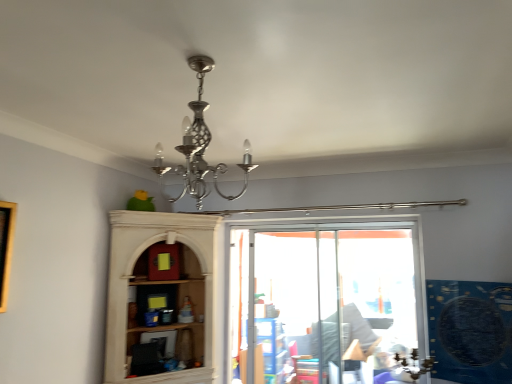
At what (x,y) coordinates should I click in order to perform the action: click on wooden picture frame at left. Please return your answer as a coordinate pair (x, y). The image size is (512, 384). Looking at the image, I should click on (6, 247).

Describe the element at coordinates (203, 145) in the screenshot. I see `polished silver chandelier at center` at that location.

I want to click on polished silver chandelier at center, so click(x=203, y=145).

This screenshot has width=512, height=384. What do you see at coordinates (273, 350) in the screenshot?
I see `blue plastic shelf at center` at bounding box center [273, 350].

Locate an element on the screen. The width and height of the screenshot is (512, 384). wooden picture frame at left is located at coordinates (6, 247).

In the image, is blue plastic shelf at center positioned in front of or behind wooden picture frame at left?

In the image, blue plastic shelf at center appears behind wooden picture frame at left.

From the picture: From a real-world perspective, is blue plastic shelf at center above or below wooden picture frame at left?

blue plastic shelf at center is situated lower than wooden picture frame at left in the real world.

Which of these two, blue plastic shelf at center or wooden picture frame at left, is bigger?

blue plastic shelf at center is bigger.

Is blue plastic shelf at center with wooden picture frame at left?

No, blue plastic shelf at center is not next to wooden picture frame at left.

Which object is wider, wooden picture frame at left or polished silver chandelier at center?

polished silver chandelier at center.

From the image's perspective, which object appears higher, wooden picture frame at left or polished silver chandelier at center?

polished silver chandelier at center is shown above in the image.

From the picture: Measure the distance between wooden picture frame at left and polished silver chandelier at center.

wooden picture frame at left is 3.69 feet from polished silver chandelier at center.

From the picture: Can you confirm if wooden picture frame at left is smaller than polished silver chandelier at center?

Yes, wooden picture frame at left is smaller than polished silver chandelier at center.

Which of these two, wooden picture frame at left or blue plastic shelf at center, is bigger?

Bigger between the two is blue plastic shelf at center.

Considering the relative positions of wooden picture frame at left and blue plastic shelf at center in the image provided, is wooden picture frame at left behind blue plastic shelf at center?

No, wooden picture frame at left is closer to the viewer.

Does wooden picture frame at left have a greater height compared to blue plastic shelf at center?

No, wooden picture frame at left is not taller than blue plastic shelf at center.

Is wooden picture frame at left next to blue plastic shelf at center?

They are not placed beside each other.

Can you confirm if polished silver chandelier at center is positioned to the right of wooden picture frame at left?

Yes, polished silver chandelier at center is to the right of wooden picture frame at left.

From a real-world perspective, is polished silver chandelier at center positioned under wooden picture frame at left based on gravity?

Actually, polished silver chandelier at center is physically above wooden picture frame at left in the real world.

Does polished silver chandelier at center have a greater height compared to wooden picture frame at left?

No.

Consider the image. From a real-world perspective, who is located higher, blue plastic shelf at center or polished silver chandelier at center?

In real-world perspective, polished silver chandelier at center is above.

Is blue plastic shelf at center in front of or behind polished silver chandelier at center in the image?

blue plastic shelf at center is behind polished silver chandelier at center.

Image resolution: width=512 pixels, height=384 pixels. Find the location of `lamp that appears on the left of blue plastic shelf at center`. lamp that appears on the left of blue plastic shelf at center is located at coordinates (203, 145).

Is point (180, 147) farther from viewer compared to point (261, 338)?

No.

Looking at their sizes, would you say polished silver chandelier at center is wider or thinner than blue plastic shelf at center?

polished silver chandelier at center is wider than blue plastic shelf at center.

Is polished silver chandelier at center not near blue plastic shelf at center?

Yes, polished silver chandelier at center is far from blue plastic shelf at center.

What are the coordinates of `shelf below the wooden picture frame at left (from a real-world perspective)` in the screenshot? It's located at (273, 350).

Locate an element on the screen. This screenshot has width=512, height=384. lamp located above the wooden picture frame at left (from a real-world perspective) is located at coordinates (203, 145).

Which object lies nearer to the anchor point wooden picture frame at left, polished silver chandelier at center or blue plastic shelf at center?

polished silver chandelier at center is positioned closer to the anchor wooden picture frame at left.

Estimate the real-world distances between objects in this image. Which object is closer to polished silver chandelier at center, wooden picture frame at left or blue plastic shelf at center?

wooden picture frame at left is positioned closer to the anchor polished silver chandelier at center.

Based on their spatial positions, is wooden picture frame at left or polished silver chandelier at center further from blue plastic shelf at center?

polished silver chandelier at center.

Considering their positions, is blue plastic shelf at center positioned closer to wooden picture frame at left than polished silver chandelier at center?

Among the two, polished silver chandelier at center is located nearer to wooden picture frame at left.

Considering their positions, is polished silver chandelier at center positioned further to blue plastic shelf at center than wooden picture frame at left?

Based on the image, polished silver chandelier at center appears to be further to blue plastic shelf at center.

From the picture: Estimate the real-world distances between objects in this image. Which object is further from polished silver chandelier at center, blue plastic shelf at center or wooden picture frame at left?

Based on the image, blue plastic shelf at center appears to be further to polished silver chandelier at center.

Find the location of a particular element. This screenshot has width=512, height=384. picture frame between polished silver chandelier at center and blue plastic shelf at center in the front-back direction is located at coordinates (6, 247).